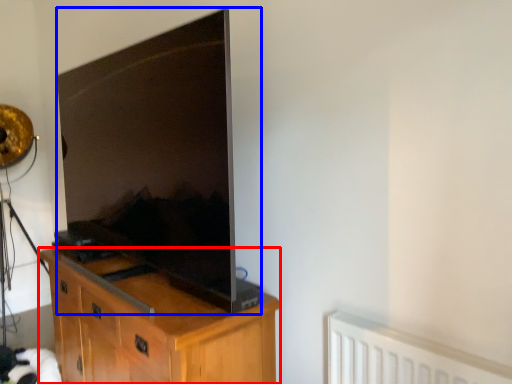
Question: Among these objects, which one is farthest to the camera, cabinetry (highlighted by a red box) or television (highlighted by a blue box)?

Choices:
 (A) cabinetry
 (B) television

Answer: (A)